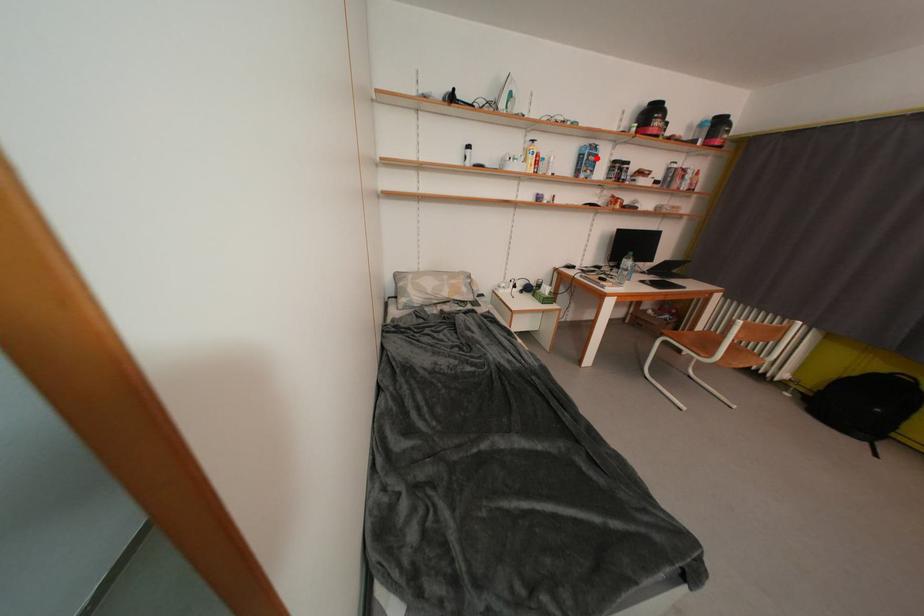
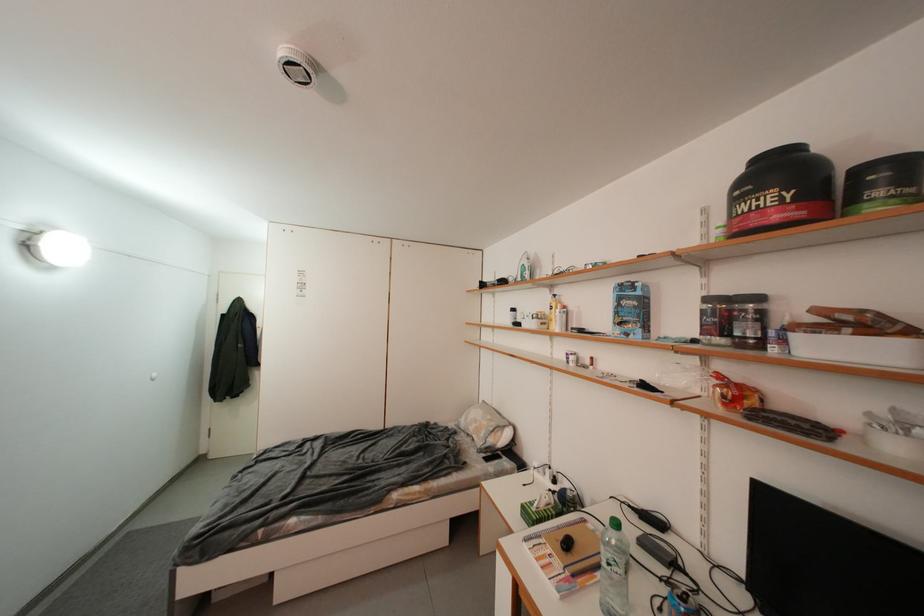
The point at the highlighted location is marked in the first image. Where is the corresponding point in the second image?

(627, 302)